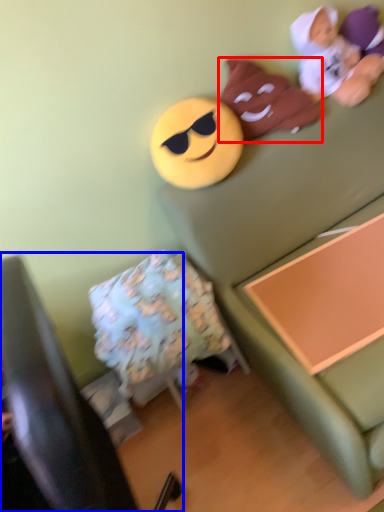
Question: Among these objects, which one is farthest to the camera, toy (highlighted by a red box) or furniture (highlighted by a blue box)?

Choices:
 (A) toy
 (B) furniture

Answer: (A)